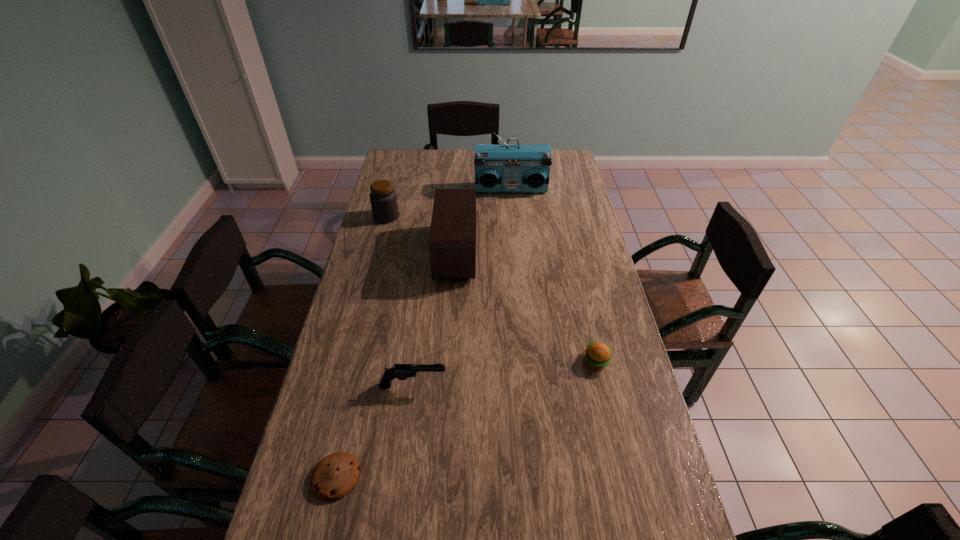
Identify the location of vacant point located between the shortest object and the taller radio receiver. (423, 333).

Locate an element on the screen. This screenshot has height=540, width=960. unoccupied position between the fourth nearest object and the fifth tallest object is located at coordinates (526, 307).

Locate an element on the screen. This screenshot has height=540, width=960. free space between the taller radio receiver and the nearer radio receiver is located at coordinates (483, 221).

Locate which object ranks third in proximity to the fourth tallest object. Please provide its 2D coordinates. Your answer should be formatted as a tuple, i.e. [(x, y)], where the tuple contains the x and y coordinates of a point satisfying the conditions above.

[(598, 355)]

Identify which object is the fourth closest to the second shortest object. Please provide its 2D coordinates. Your answer should be formatted as a tuple, i.e. [(x, y)], where the tuple contains the x and y coordinates of a point satisfying the conditions above.

[(498, 168)]

Identify the location of free spot that satisfies the following two spatial constraints: 1. on the surface of the nearest object near the warning symbol; 2. on the left side of the fourth shortest object. Image resolution: width=960 pixels, height=540 pixels. (320, 477).

Find the location of `vacant area that satisfies the following two spatial constraints: 1. on the front side of the rightmost object; 2. at the end of the barrel of the third shortest object`. vacant area that satisfies the following two spatial constraints: 1. on the front side of the rightmost object; 2. at the end of the barrel of the third shortest object is located at coordinates (602, 385).

Locate an element on the screen. Image resolution: width=960 pixels, height=540 pixels. free location that satisfies the following two spatial constraints: 1. on the surface of the second farthest object near the warning symbol; 2. on the right side of the fifth tallest object is located at coordinates (349, 361).

Identify the location of free space that satisfies the following two spatial constraints: 1. at the end of the barrel of the fifth farthest object; 2. on the front side of the shortest object. Image resolution: width=960 pixels, height=540 pixels. (401, 477).

The height and width of the screenshot is (540, 960). I want to click on free space that satisfies the following two spatial constraints: 1. on the front-facing side of the farther radio receiver; 2. at the end of the barrel of the fourth tallest object, so click(x=529, y=385).